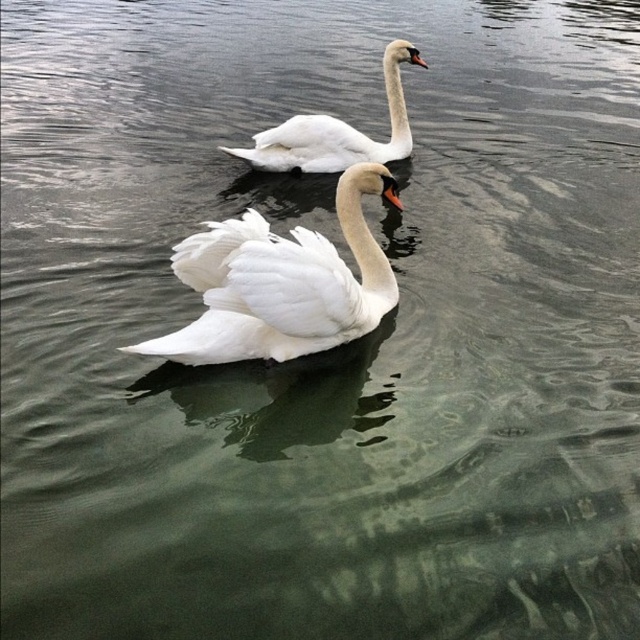
You are standing on a dock and see the white feathered swan at center. If you want to throw a small pebble to reach the swan, and your throwing distance is 4 meters, will the pebble reach the swan?

The white feathered swan at center is 4.40 meters away from the viewer. Since your throwing distance is 4 meters, the pebble will not reach the swan.

You are a photographer aiming to capture the white feathered swan at center. Based on the scene, where should you position your camera to ensure the swan is centered in your shot?

The white feathered swan at center is located at the 2D coordinates point (282, 284), so positioning the camera to center on those coordinates will ensure the swan is centered in the shot.

You are standing at the edge of the water and see the point marked at coordinates (282,284). What is the object located at that point?

The point at coordinates (282,284) indicates the white feathered swan at center.